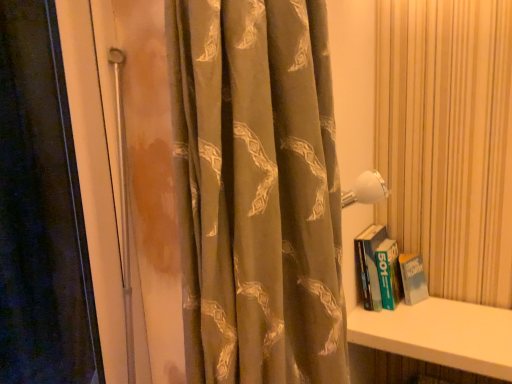
Find the location of a particular element. Image resolution: width=512 pixels, height=384 pixels. unoccupied region to the right of green matte book at right is located at coordinates (459, 314).